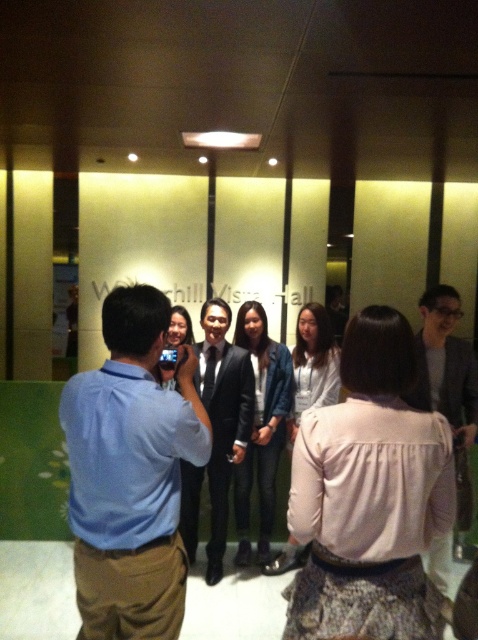
In the scene shown: Is blue shirt at left behind black suit at center?

That is False.

Who is shorter, blue shirt at left or black suit at center?

With less height is blue shirt at left.

Is point (107, 598) positioned behind point (201, 394)?

No, (107, 598) is closer to viewer.

Find the location of a particular element. blue shirt at left is located at coordinates pos(130,474).

Is black suit at center positioned before matte black suit at center?

No, it is behind matte black suit at center.

Locate an element on the screen. The image size is (478, 640). black suit at center is located at coordinates (223, 417).

Which is above, blue shirt at left or matte black suit at center?

blue shirt at left is above.

Who is lower down, blue shirt at left or matte black suit at center?

matte black suit at center is lower down.

Which is behind, point (159, 548) or point (444, 589)?

Positioned behind is point (444, 589).

Identify the location of blue shirt at left. (130, 474).